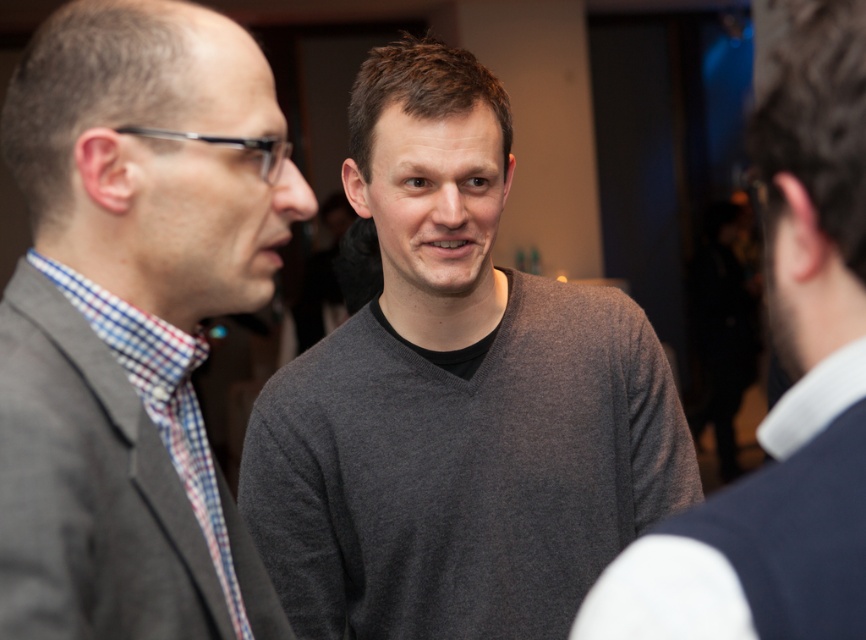
Question: Can you confirm if gray matte sweater at center is positioned to the left of matte gray sweater at center?

Choices:
 (A) no
 (B) yes

Answer: (A)

Question: Does matte gray sweater at center have a greater width compared to dark gray sweater at center?

Choices:
 (A) no
 (B) yes

Answer: (B)

Question: Does matte gray sweater at center appear over checkered fabric tie at left?

Choices:
 (A) no
 (B) yes

Answer: (B)

Question: Which point is closer to the camera?

Choices:
 (A) dark gray sweater at center
 (B) gray matte sweater at center
 (C) matte gray sweater at center
 (D) checkered fabric tie at left

Answer: (A)

Question: Which object is farther from the camera taking this photo?

Choices:
 (A) checkered fabric tie at left
 (B) gray matte sweater at center

Answer: (B)

Question: Among these points, which one is farthest from the camera?

Choices:
 (A) (711, 584)
 (B) (207, 531)
 (C) (123, 88)
 (D) (602, 294)

Answer: (D)